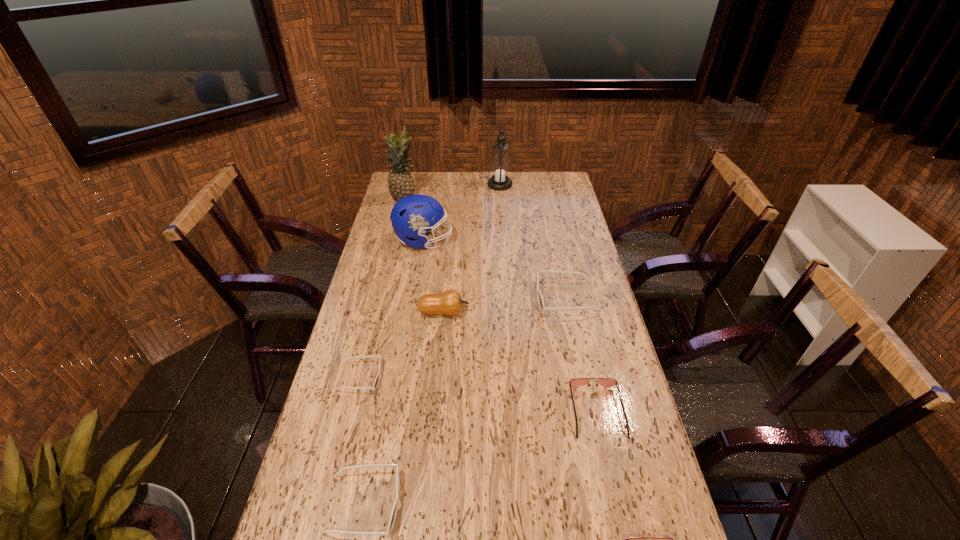
The height and width of the screenshot is (540, 960). Identify the location of oil lamp. (500, 166).

Where is `pineapple`? The image size is (960, 540). pineapple is located at coordinates (400, 181).

You are a GUI agent. You are given a task and a screenshot of the screen. Output one action in this format:
    pyautogui.click(x=<x>, y=<y>)
    Task: Click on the third farthest object
    The image size is (960, 540).
    Given the screenshot: What is the action you would take?
    pyautogui.click(x=412, y=216)

Where is `the seventh shortest object`? the seventh shortest object is located at coordinates (412, 216).

Where is `the sixth shortest object`? Image resolution: width=960 pixels, height=540 pixels. the sixth shortest object is located at coordinates (449, 302).

Where is `the tallest sunglasses`? the tallest sunglasses is located at coordinates (540, 299).

Find the location of a particular element. The image size is (960, 540). the farthest black sunglasses is located at coordinates (540, 299).

At what (x,y) coordinates should I click in order to perform the action: click on the bigger pink sunglasses. Please return your answer as a coordinate pair (x, y). The image size is (960, 540). Looking at the image, I should click on (575, 382).

This screenshot has width=960, height=540. In order to click on the second nearest black sunglasses in this screenshot , I will do `click(376, 381)`.

Find the location of a particular element. The height and width of the screenshot is (540, 960). free space located 0.080m on the front of the oil lamp is located at coordinates (501, 201).